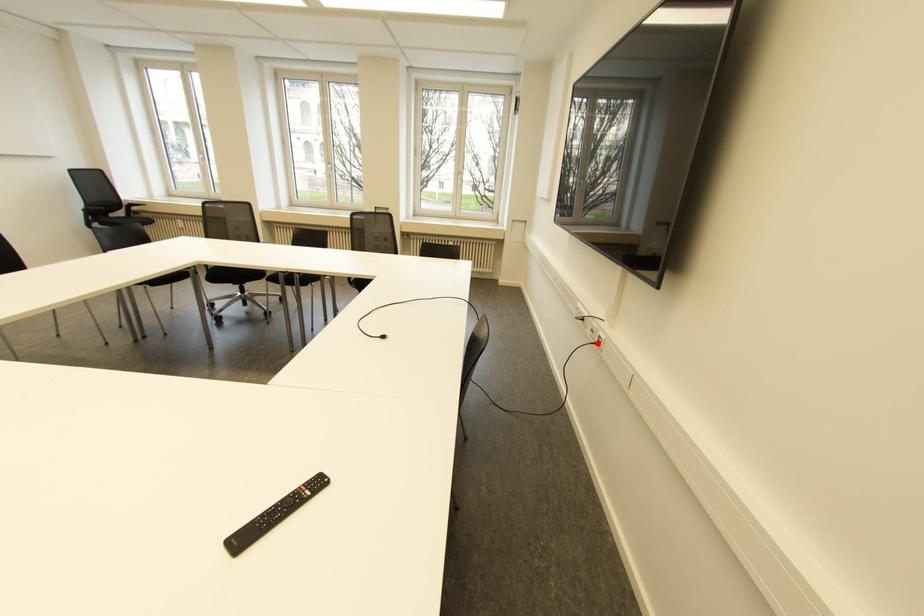
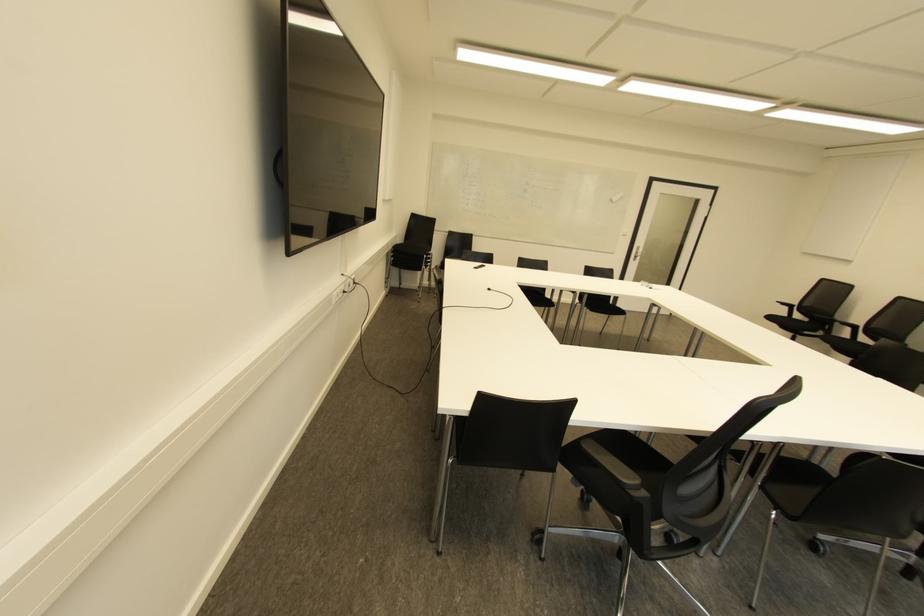
Question: I am providing you with two images of the same scene from different viewpoints. Image1 has a red point marked. In image2, the corresponding 3D location appears at what relative position? Reply with the corresponding letter.

Choices:
 (A) Closer
 (B) Farther

Answer: (A)